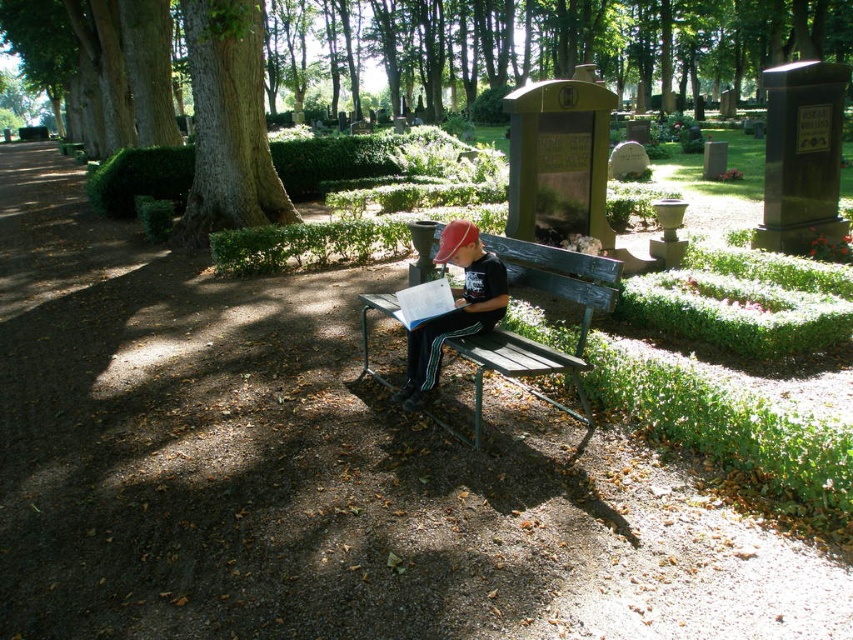
You are planning to take a photo of the wooden bench at center but want to ensure the green textured tree at upper left doesn t block the view. Based on the scene description, can you determine if the tree will obscure the bench?

The green textured tree at upper left is larger in size than the wooden bench at center, so it might block the view of the bench depending on their positions. However, since the bench is under the shade of large trees, it is possible that the tree is positioned above the bench, casting shadows but not necessarily blocking the entire view. To be certain, you would need to adjust your angle or move closer to ensure the tree doesn t cover the bench in the frame.

You are a photographer trying to capture a closeup of the matte black cap at center while also including the wooden bench at center in the frame. Can you fit both objects in the same photo without moving either?

The wooden bench at center and matte black cap at center are 12.29 inches apart from each other. Since both objects are positioned close to each other at the center, they can be captured in the same photo without needing to move them.

You are planning to take a photo of the wooden bench at center. To avoid having the green textured tree at upper left blocking the view, where should you position yourself relative to the bench?

Position yourself to the right side of the wooden bench at center so that the green textured tree at upper left is out of frame.